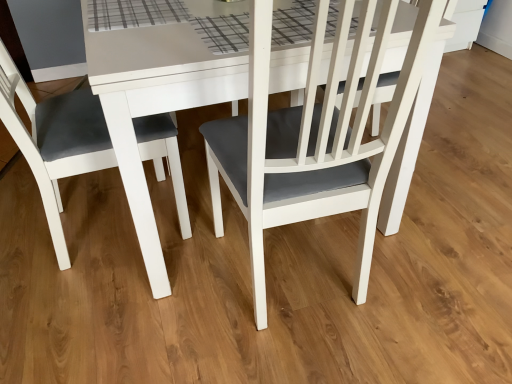
Question: Looking at the image, does matte white chair at left, the first chair positioned from the left, seem bigger or smaller compared to matte white chair at center, acting as the first chair starting from the right?

Choices:
 (A) big
 (B) small

Answer: (B)

Question: Considering the relative positions of matte white chair at left, which ranks as the second chair in right-to-left order, and matte white chair at center, the 2th chair from the left, in the image provided, is matte white chair at left, which ranks as the second chair in right-to-left order, to the left or to the right of matte white chair at center, the 2th chair from the left,?

Choices:
 (A) right
 (B) left

Answer: (B)

Question: From the image's perspective, is matte white chair at left, which ranks as the second chair in right-to-left order, located above or below matte white chair at center, acting as the first chair starting from the right?

Choices:
 (A) above
 (B) below

Answer: (B)

Question: From the image's perspective, relative to matte white chair at left, which ranks as the second chair in right-to-left order, is matte white chair at center, acting as the first chair starting from the right, above or below?

Choices:
 (A) below
 (B) above

Answer: (B)

Question: Would you say matte white chair at center, acting as the first chair starting from the right, is inside or outside matte white chair at left, which ranks as the second chair in right-to-left order?

Choices:
 (A) outside
 (B) inside

Answer: (A)

Question: Would you say matte white chair at center, acting as the first chair starting from the right, is to the left or to the right of matte white chair at left, the first chair positioned from the left, in the picture?

Choices:
 (A) right
 (B) left

Answer: (A)

Question: Is point (309, 54) positioned closer to the camera than point (38, 135)?

Choices:
 (A) farther
 (B) closer

Answer: (B)